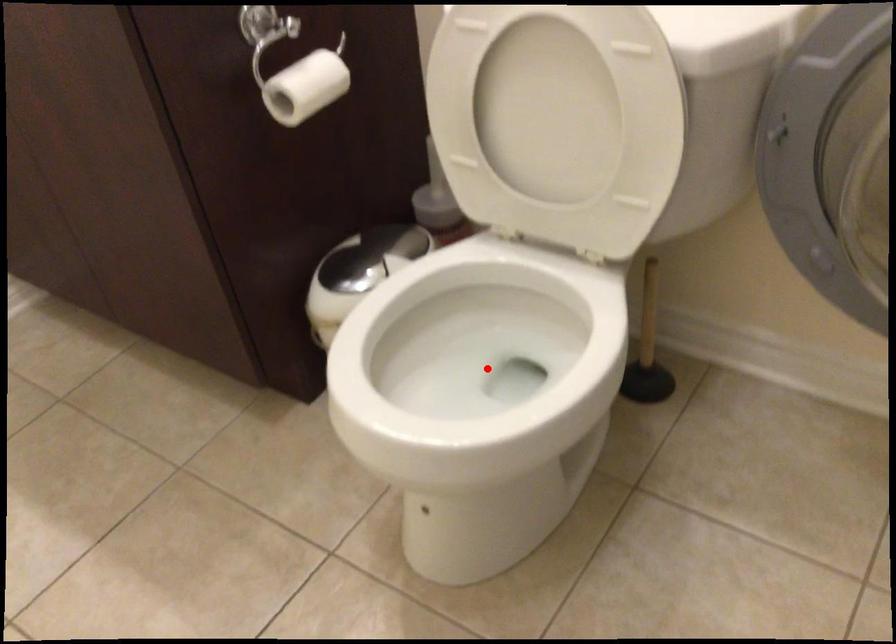
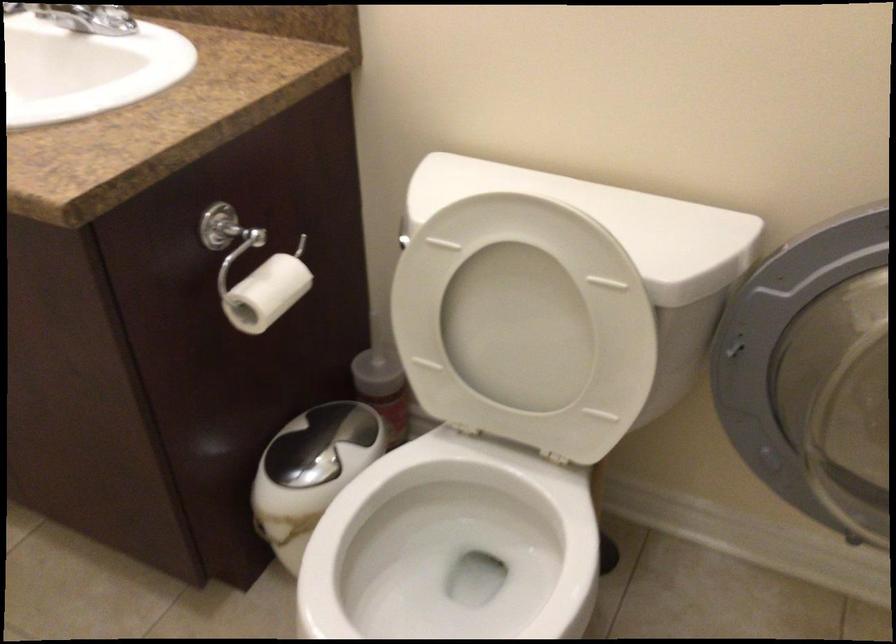
Locate, in the second image, the point that corresponds to the highlighted location in the first image.

(449, 564)